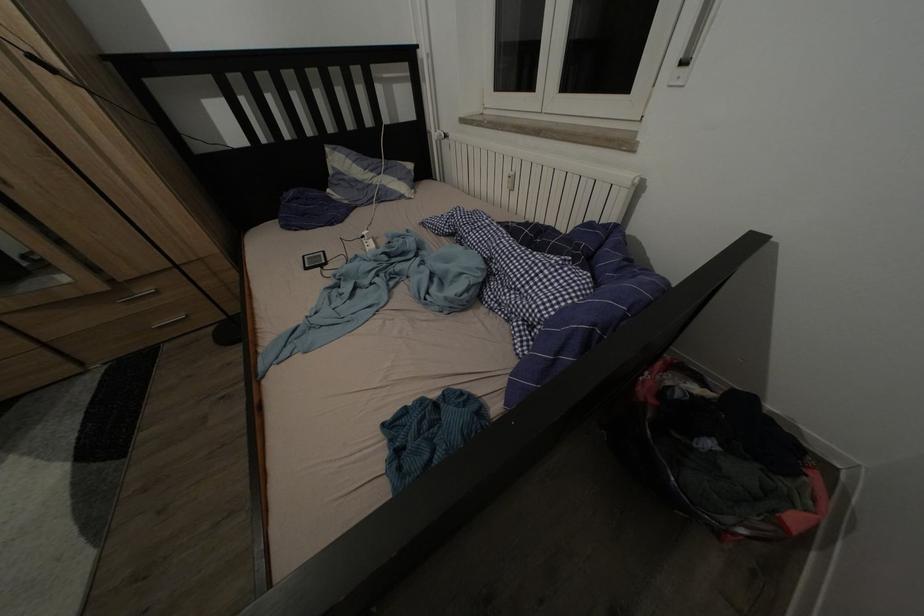
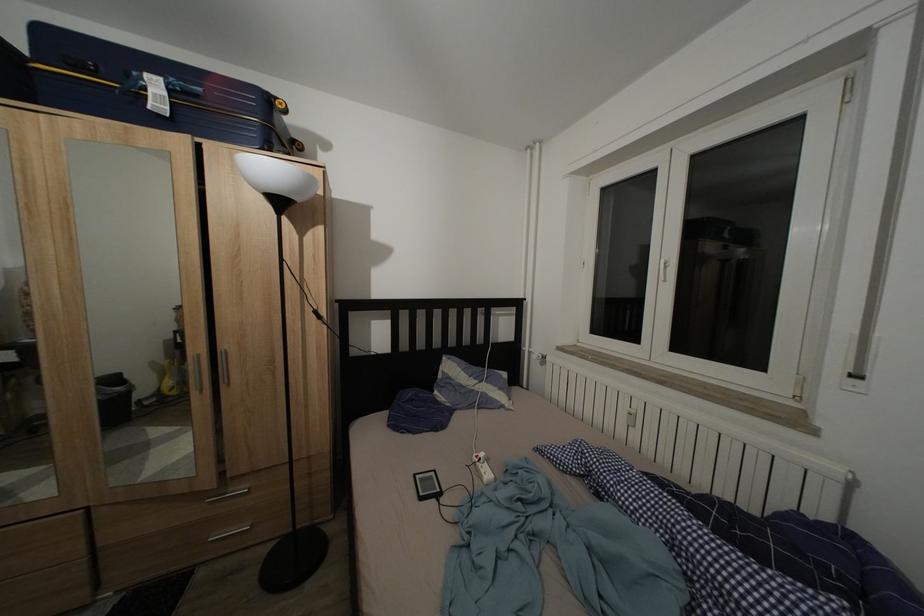
Question: How did the camera likely rotate?

Choices:
 (A) Left
 (B) Right
 (C) Up
 (D) Down

Answer: (C)